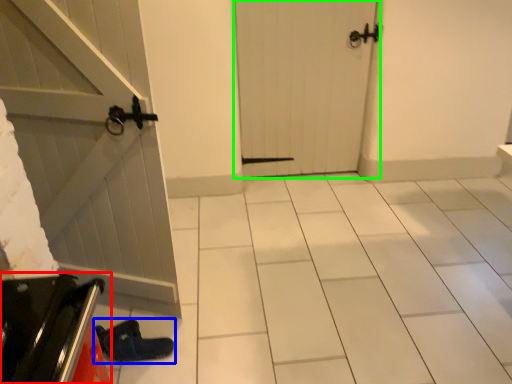
Question: Which is nearer to the appliance (highlighted by a red box)? footwear (highlighted by a blue box) or door (highlighted by a green box).

Choices:
 (A) footwear
 (B) door

Answer: (A)